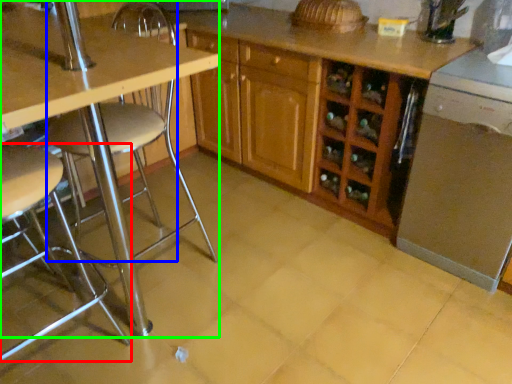
Question: Which object is the farthest from chair (highlighted by a red box)? Choose among these: swivel chair (highlighted by a blue box) or table (highlighted by a green box).

Choices:
 (A) swivel chair
 (B) table

Answer: (A)